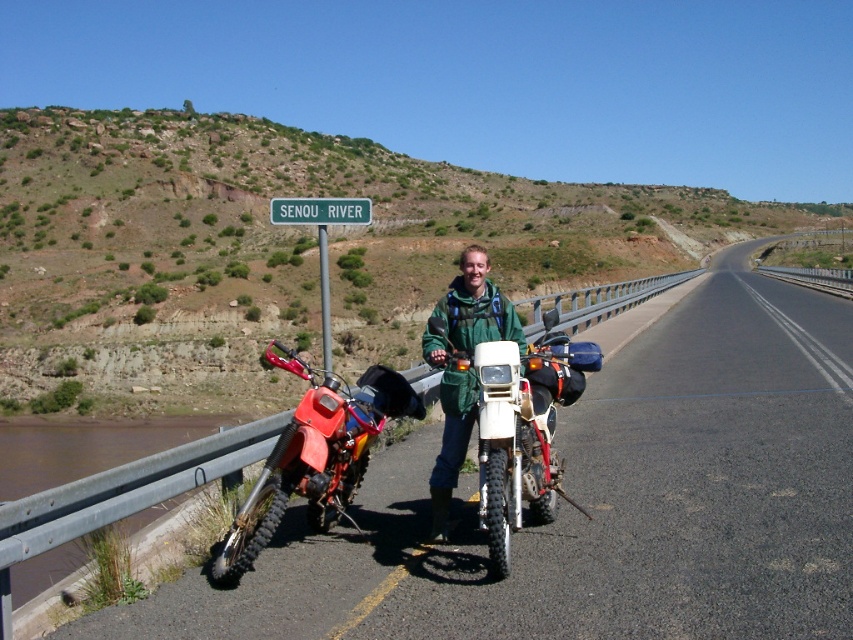
Question: Which object appears closest to the camera in this image?

Choices:
 (A) white matte motorcycle at center
 (B) asphalt road at center
 (C) green plastic sign at upper center

Answer: (B)

Question: Which object is farther from the camera taking this photo?

Choices:
 (A) orange matte dirt bike at left
 (B) asphalt road at center

Answer: (A)

Question: Is asphalt road at center positioned before greenmaterial/texturestreet sign at upper center?

Choices:
 (A) yes
 (B) no

Answer: (A)

Question: Which object is the closest to the asphalt road at center?

Choices:
 (A) white matte motorcycle at center
 (B) orange matte dirt bike at left
 (C) green plastic sign at upper center

Answer: (A)

Question: Can you confirm if orange matte dirt bike at left is thinner than greenmaterial/texturestreet sign at upper center?

Choices:
 (A) no
 (B) yes

Answer: (A)

Question: Can you confirm if white matte motorcycle at center is positioned to the right of green plastic sign at upper center?

Choices:
 (A) no
 (B) yes

Answer: (B)